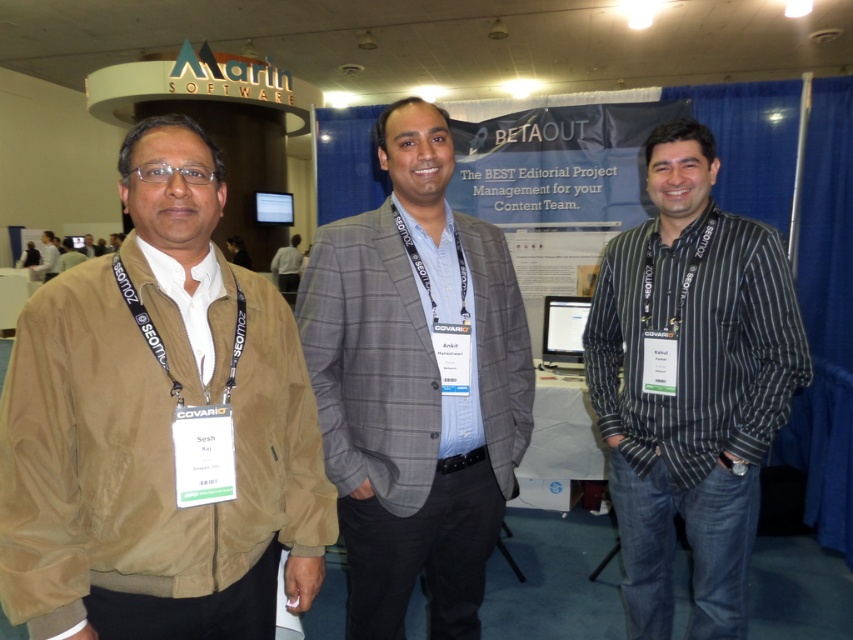
Is black striped shirt at center smaller than brown leather jacket at left?

Yes, black striped shirt at center is smaller than brown leather jacket at left.

Describe the element at coordinates (689, 385) in the screenshot. I see `black striped shirt at center` at that location.

This screenshot has height=640, width=853. Find the location of `black striped shirt at center`. black striped shirt at center is located at coordinates (689, 385).

What do you see at coordinates (287, 268) in the screenshot?
I see `white shirt at center` at bounding box center [287, 268].

Is point (279, 252) behind point (45, 268)?

No, (279, 252) is in front of (45, 268).

This screenshot has width=853, height=640. What do you see at coordinates (287, 268) in the screenshot?
I see `white shirt at center` at bounding box center [287, 268].

Where is `white shirt at center`? Image resolution: width=853 pixels, height=640 pixels. white shirt at center is located at coordinates (287, 268).

Does tan suede jacket at left have a greater height compared to white shirt at center?

In fact, tan suede jacket at left may be shorter than white shirt at center.

In the scene shown: Between tan suede jacket at left and white shirt at center, which one appears on the left side from the viewer's perspective?

white shirt at center

Between point (219, 636) and point (296, 260), which one is positioned behind?

Point (296, 260)

The height and width of the screenshot is (640, 853). What are the coordinates of `tan suede jacket at left` in the screenshot? It's located at (160, 428).